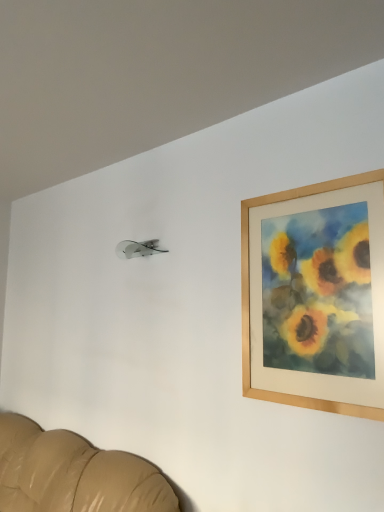
Question: In terms of width, does wooden picture frame at upper right look wider or thinner when compared to leather couch at lower left?

Choices:
 (A) thin
 (B) wide

Answer: (A)

Question: Do you think wooden picture frame at upper right is within leather couch at lower left, or outside of it?

Choices:
 (A) inside
 (B) outside

Answer: (B)

Question: Considering their positions, is wooden picture frame at upper right located in front of or behind leather couch at lower left?

Choices:
 (A) front
 (B) behind

Answer: (B)

Question: Considering their positions, is leather couch at lower left located in front of or behind wooden picture frame at upper right?

Choices:
 (A) behind
 (B) front

Answer: (B)

Question: In terms of size, does leather couch at lower left appear bigger or smaller than wooden picture frame at upper right?

Choices:
 (A) big
 (B) small

Answer: (A)

Question: Considering the relative positions of leather couch at lower left and wooden picture frame at upper right in the image provided, is leather couch at lower left to the left or to the right of wooden picture frame at upper right?

Choices:
 (A) right
 (B) left

Answer: (B)

Question: Considering the positions of leather couch at lower left and wooden picture frame at upper right in the image, is leather couch at lower left wider or thinner than wooden picture frame at upper right?

Choices:
 (A) wide
 (B) thin

Answer: (A)